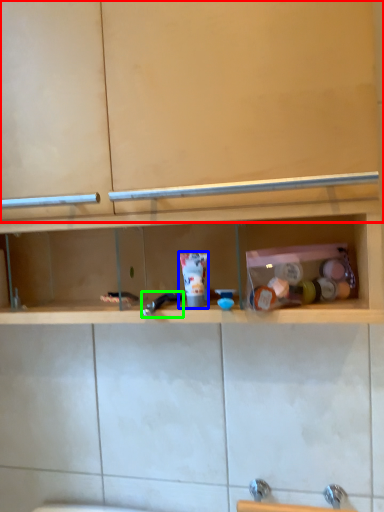
Question: Which is nearer to the cabinet (highlighted by a red box)? toiletry (highlighted by a blue box) or faucet (highlighted by a green box).

Choices:
 (A) toiletry
 (B) faucet

Answer: (A)